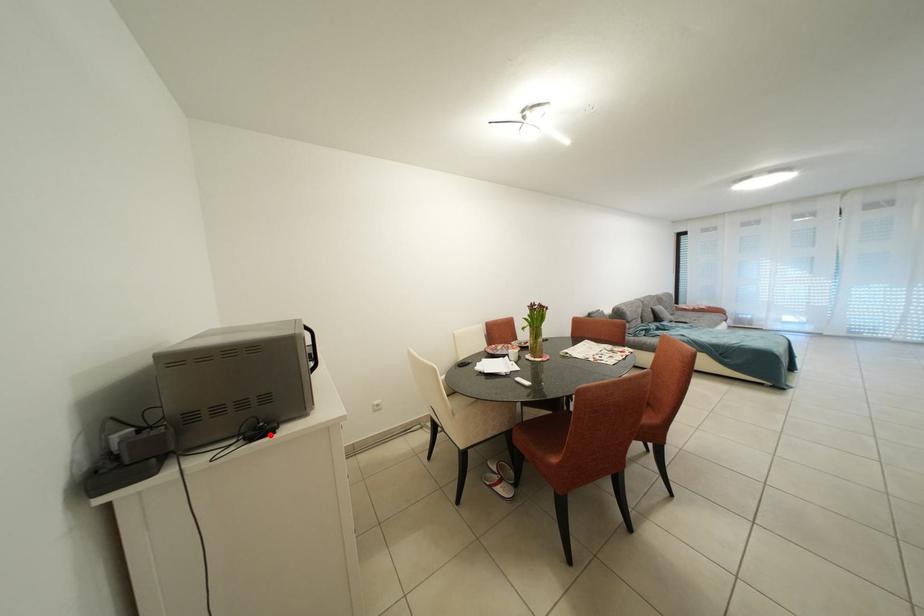
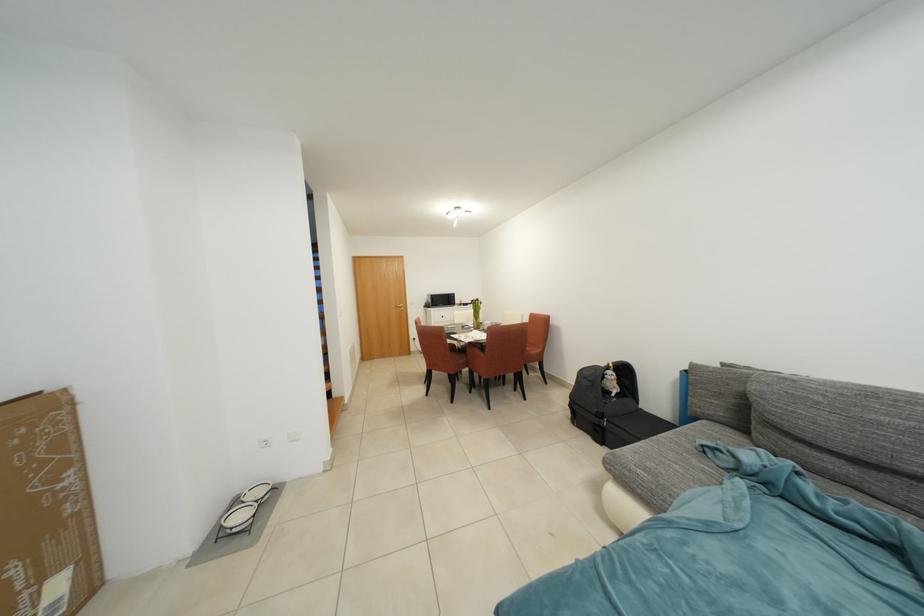
Question: I am providing you with two images of the same scene from different viewpoints. A red point is marked on the first image. Can you still see the location of the red point in image 2?

Choices:
 (A) Yes
 (B) No

Answer: (B)